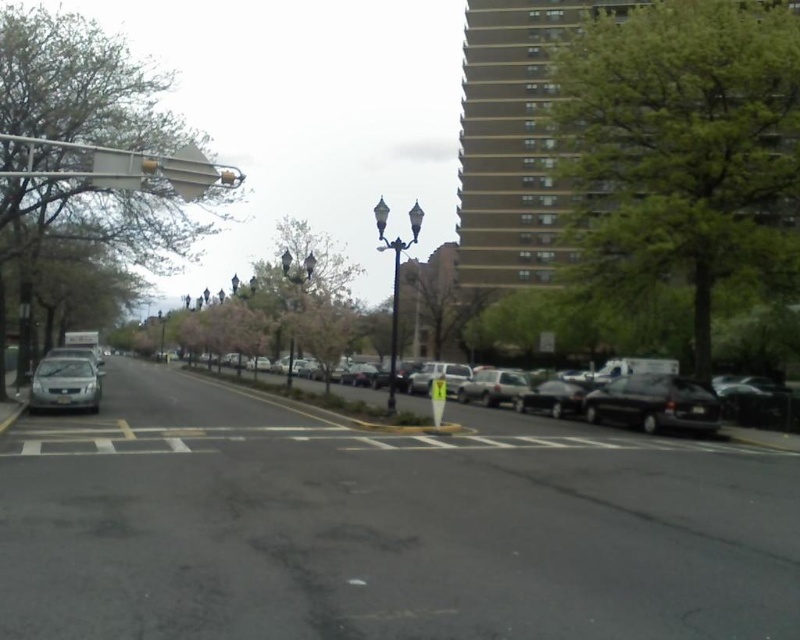
Which is in front, point (160, 339) or point (26, 301)?

Point (26, 301)

In the scene shown: Which is more to the right, black metal lamp post at center or metallic silver traffic light at upper left?

metallic silver traffic light at upper left

Between point (164, 344) and point (20, 304), which one is positioned behind?

Point (164, 344)

Find the location of a particular element. The image size is (800, 640). black metal lamp post at center is located at coordinates pos(162,337).

Does satin silver sedan at lower left appear under shiny black sedan at center?

Incorrect, satin silver sedan at lower left is not positioned below shiny black sedan at center.

Consider the image. Which is more to the right, satin silver sedan at lower left or shiny black sedan at center?

From the viewer's perspective, shiny black sedan at center appears more on the right side.

Locate an element on the screen. The width and height of the screenshot is (800, 640). satin silver sedan at lower left is located at coordinates (64, 385).

Can you confirm if black metal streetlight at center is shorter than metallic silver traffic light at upper left?

No.

Does point (288, 381) lie behind point (24, 289)?

That is True.

The image size is (800, 640). What do you see at coordinates (297, 269) in the screenshot?
I see `black metal streetlight at center` at bounding box center [297, 269].

The width and height of the screenshot is (800, 640). In order to click on black metal streetlight at center in this screenshot , I will do `click(297, 269)`.